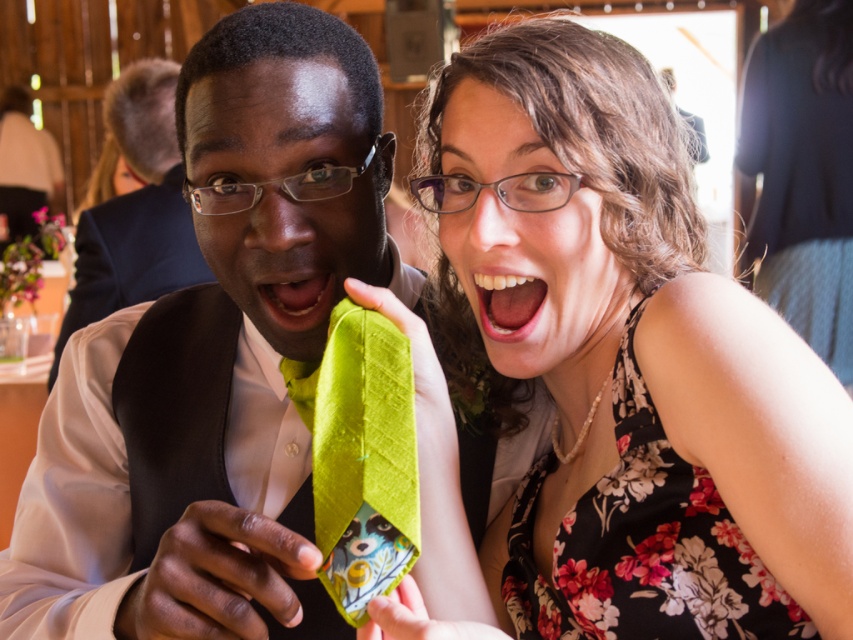
Is point (432, 170) less distant than point (503, 301)?

No.

Between point (529, 628) and point (477, 305), which one is positioned behind?

The point (529, 628) is more distant.

This screenshot has width=853, height=640. In order to click on floral fabric dress at center in this screenshot , I will do `click(636, 365)`.

Can you confirm if bright green fabric at center is positioned to the left of white glossy teeth at center?

Correct, you'll find bright green fabric at center to the left of white glossy teeth at center.

Is bright green fabric at center closer to the viewer compared to white glossy teeth at center?

No, it is not.

Is point (256, 300) positioned behind point (527, 276)?

Yes, point (256, 300) is behind point (527, 276).

Where is `bright green fabric at center`? bright green fabric at center is located at coordinates (292, 300).

Where is `floral fabric dress at center`? floral fabric dress at center is located at coordinates (636, 365).

Can you confirm if floral fabric dress at center is positioned above green silk tie at center?

Yes, floral fabric dress at center is above green silk tie at center.

Find the location of a particular element. floral fabric dress at center is located at coordinates (636, 365).